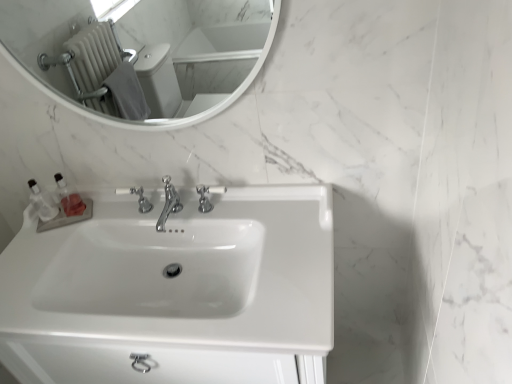
I want to click on free space that is in between clear plastic bottles at left, the 1th toiletry from the left, and chrome metallic faucet at center, acting as the first tap starting from the left, so click(x=100, y=219).